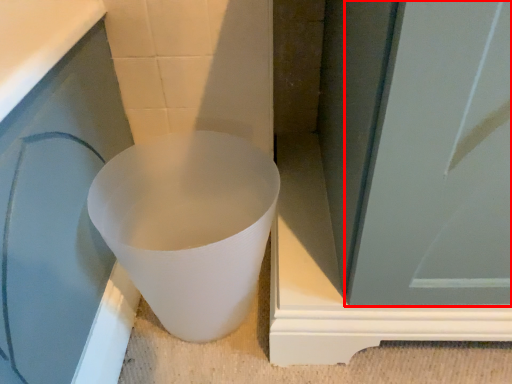
Question: Observing the image, what is the correct spatial positioning of screen door (annotated by the red box) in reference to toilet?

Choices:
 (A) left
 (B) right

Answer: (B)